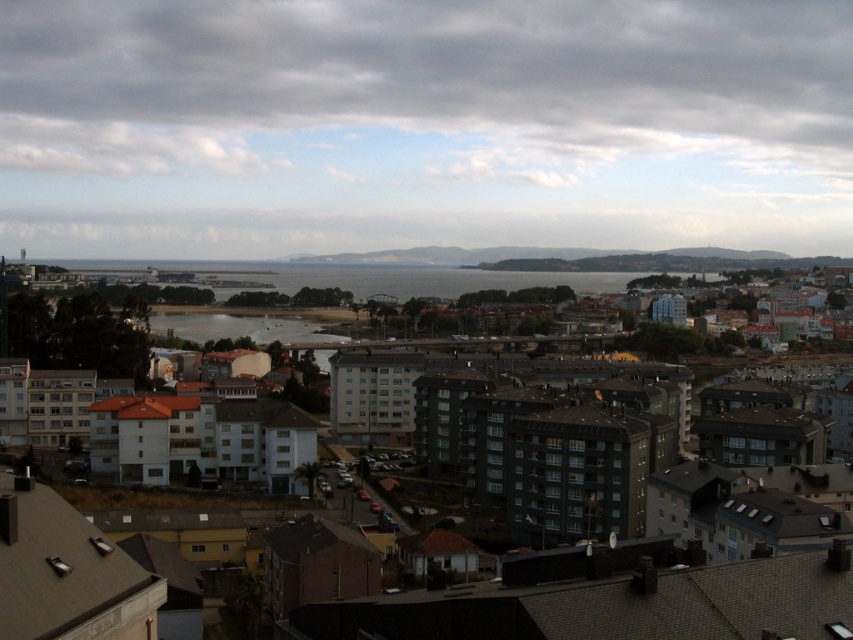
Can you confirm if matte gray buildings at center is taller than clear water at center?

No.

Who is positioned more to the right, matte gray buildings at center or clear water at center?

matte gray buildings at center is more to the right.

Who is more distant from viewer, (619, 568) or (337, 339)?

Positioned behind is point (337, 339).

The image size is (853, 640). I want to click on matte gray buildings at center, so click(x=610, y=600).